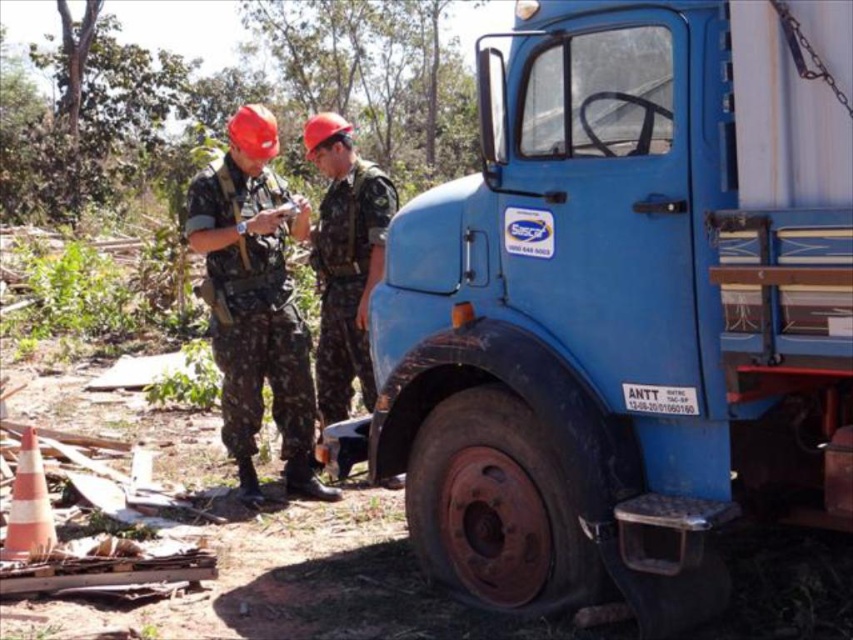
You are a photographer observing two people in camouflage fabric uniforms near a truck. You need to capture a photo where the camouflage fabric uniform at left is visible above the camouflage fabric uniform at center. Is this possible based on their current positions?

The camouflage fabric uniform at left is located below the camouflage fabric uniform at center, so it would not be possible to capture a photo where the camouflage fabric uniform at left is visible above the camouflage fabric uniform at center without moving them.

Based on the photo, you are a photographer standing in the forest area. You want to take a photo of the two points mentioned in the scene. Which point is closer to you, point (x=830, y=84) or point (x=322, y=342)?

Point (x=830, y=84) is closer to the viewer than point (x=322, y=342).

You are a photographer trying to capture both the camouflage fabric uniform at left and the camouflage fabric uniform at center in a single frame. Which uniform should you focus on first to ensure both are visible in the photo?

The camouflage fabric uniform at left occupies less space than the camouflage fabric uniform at center, so you should focus on the camouflage fabric uniform at center first to ensure both are visible in the photo.